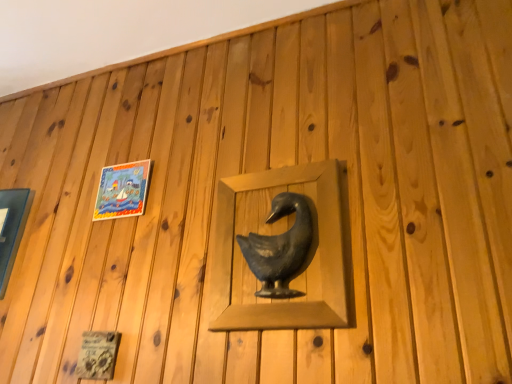
Question: Is matte black duck at center taller or shorter than matte plastic picture frame at upper left, placed as the 1th picture frame when sorted from right to left?

Choices:
 (A) short
 (B) tall

Answer: (B)

Question: Considering their positions, is matte black duck at center located in front of or behind matte plastic picture frame at upper left, placed as the 1th picture frame when sorted from right to left?

Choices:
 (A) front
 (B) behind

Answer: (A)

Question: Which object is the closest to the matte glass picture frame at left, marked as the first picture frame in a left-to-right arrangement?

Choices:
 (A) matte black duck at center
 (B) matte plastic picture frame at upper left, the 2th picture frame when ordered from left to right

Answer: (B)

Question: Which object is positioned farthest from the matte plastic picture frame at upper left, the 2th picture frame when ordered from left to right?

Choices:
 (A) matte black duck at center
 (B) matte glass picture frame at left, which is counted as the 2th picture frame, starting from the right

Answer: (A)